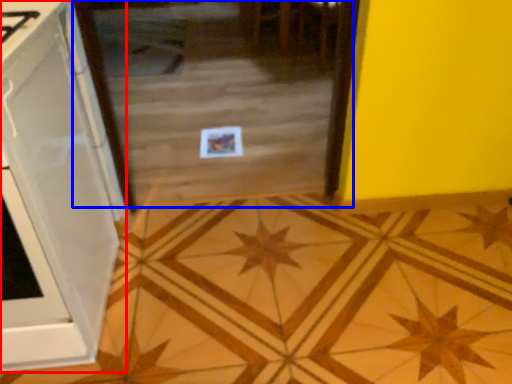
Question: Which of the following is the closest to the observer, cabinetry (highlighted by a red box) or glass door (highlighted by a blue box)?

Choices:
 (A) cabinetry
 (B) glass door

Answer: (A)